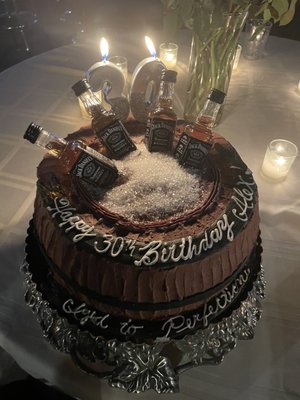
The width and height of the screenshot is (300, 400). I want to click on vase, so click(x=209, y=50).